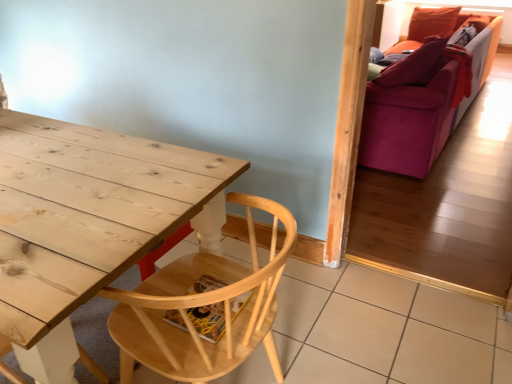
Question: Is point (292, 241) closer or farther from the camera than point (412, 69)?

Choices:
 (A) farther
 (B) closer

Answer: (B)

Question: Looking at their shapes, would you say natural wood chair at lower left is wider or thinner than velvet purple couch at right?

Choices:
 (A) thin
 (B) wide

Answer: (A)

Question: Considering the positions of natural wood chair at lower left and velvet purple couch at right in the image, is natural wood chair at lower left taller or shorter than velvet purple couch at right?

Choices:
 (A) short
 (B) tall

Answer: (A)

Question: From a real-world perspective, relative to natural wood chair at lower left, is velvet purple couch at right vertically above or below?

Choices:
 (A) below
 (B) above

Answer: (B)

Question: Is velvet purple couch at right taller or shorter than natural wood chair at lower left?

Choices:
 (A) short
 (B) tall

Answer: (B)

Question: Looking at the image, does velvet purple couch at right seem bigger or smaller compared to natural wood chair at lower left?

Choices:
 (A) big
 (B) small

Answer: (A)

Question: From the image's perspective, is velvet purple couch at right located above or below natural wood chair at lower left?

Choices:
 (A) below
 (B) above

Answer: (B)